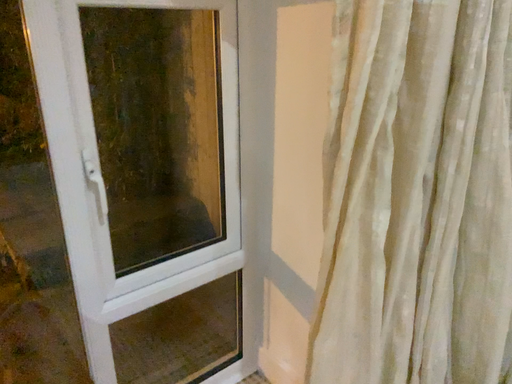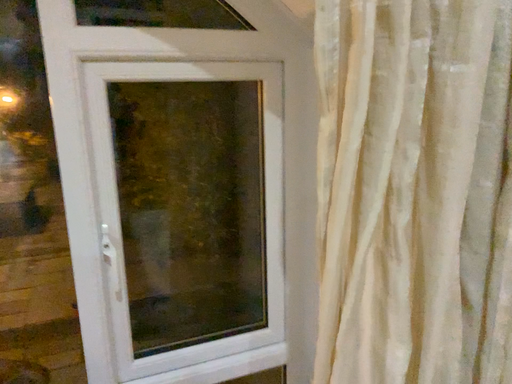
Question: How did the camera likely rotate when shooting the video?

Choices:
 (A) rotated upward
 (B) rotated downward

Answer: (A)